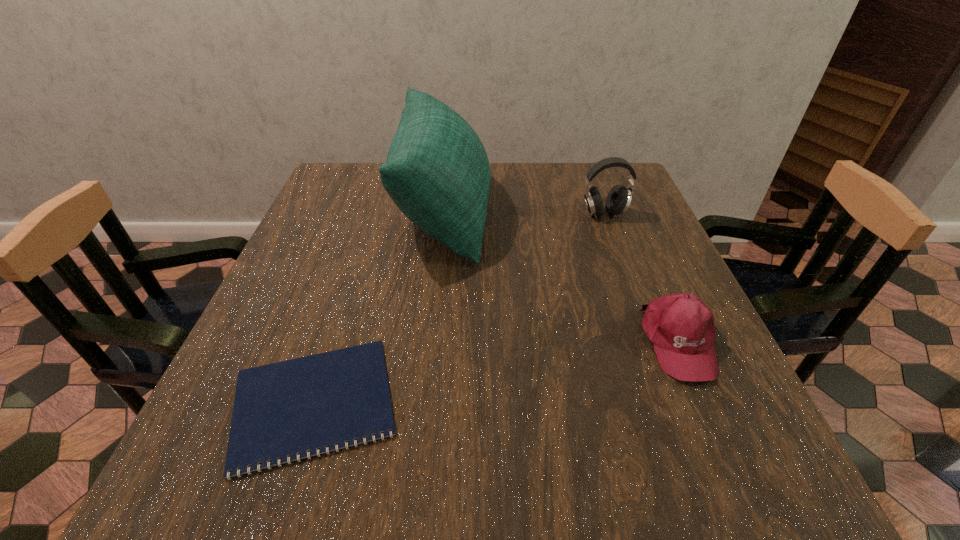
Image resolution: width=960 pixels, height=540 pixels. I want to click on free point at the far left corner, so click(382, 163).

I want to click on free location at the near left corner, so click(x=277, y=487).

The width and height of the screenshot is (960, 540). Identify the location of vacant area at the far right corner. (608, 191).

Find the location of a particular element. Image resolution: width=960 pixels, height=540 pixels. vacant space at the near right corner is located at coordinates click(669, 454).

Where is `free spot between the headset and the third tallest object`? The image size is (960, 540). free spot between the headset and the third tallest object is located at coordinates click(641, 278).

What are the coordinates of `free space that is in between the headset and the shortest object` in the screenshot? It's located at (459, 308).

Identify the location of vacant area that lies between the headset and the shortest object. (459, 308).

Where is `vacant point located between the baseball cap and the headset`? This screenshot has height=540, width=960. vacant point located between the baseball cap and the headset is located at coordinates (641, 278).

Where is `empty location between the baseball cap and the tallest object`? The width and height of the screenshot is (960, 540). empty location between the baseball cap and the tallest object is located at coordinates (562, 277).

At what (x,y) coordinates should I click in order to perform the action: click on vacant area between the second shortest object and the cushion. Please return your answer as a coordinate pair (x, y). The width and height of the screenshot is (960, 540). Looking at the image, I should click on (562, 277).